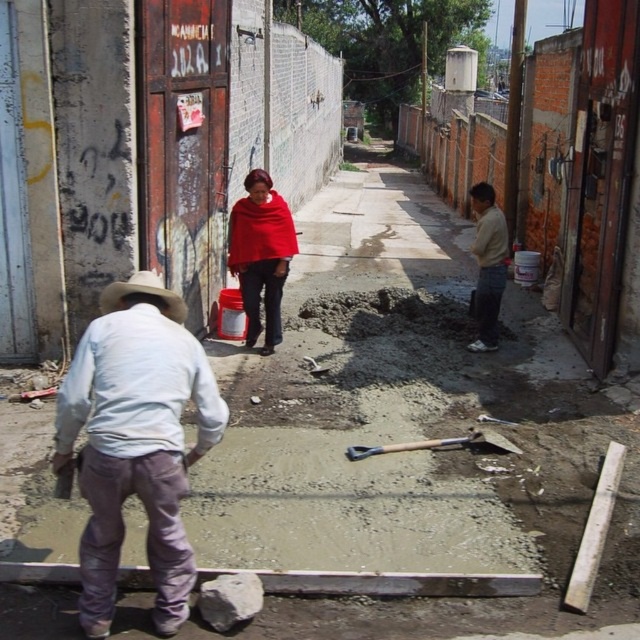
You are a delivery person who needs to deliver a package to the woman wearing the light beige sweater at right. The path to her is blocked by the freshly poured wet concrete. Can you walk around the light blue cotton shirt at left to reach her?

The light blue cotton shirt at left is in front of the light beige sweater at right, so you can walk around the light blue cotton shirt at left to reach the light beige sweater at right.

You are standing in the middle of the alleyway and want to hand a tool to both the light blue cotton shirt at left and the light beige sweater at right. Which person is closer to you?

The light blue cotton shirt at left is 15.88 feet away from the light beige sweater at right. Since you are in the middle, the light blue cotton shirt at left is closer to you than the light beige sweater at right.